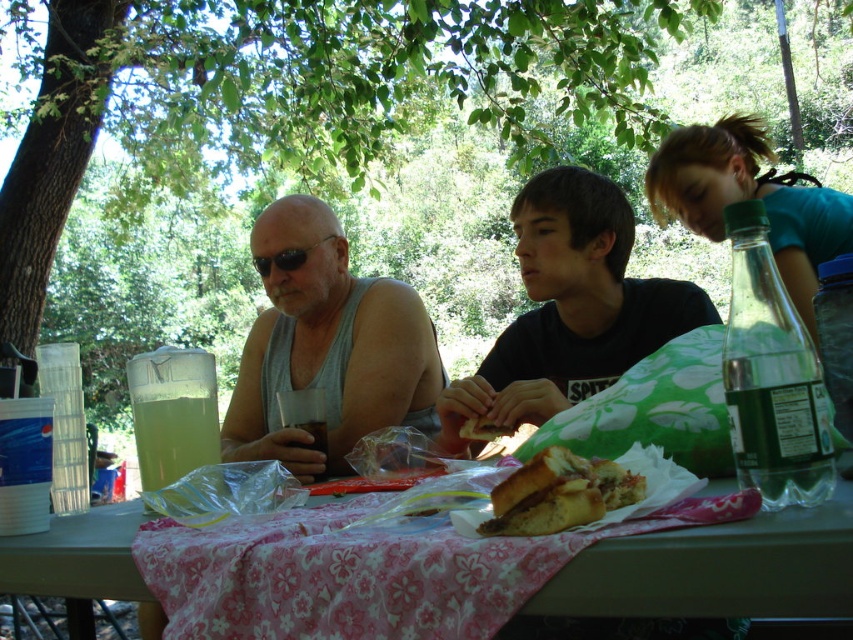
Is brown bread sandwich at center below translucent plastic cup at center?

No.

Does brown bread sandwich at center have a greater width compared to translucent plastic cup at center?

Correct, the width of brown bread sandwich at center exceeds that of translucent plastic cup at center.

Image resolution: width=853 pixels, height=640 pixels. I want to click on brown bread sandwich at center, so click(x=558, y=493).

Does pink floral tablecloth at lower center appear over black matte shirt at center?

No, pink floral tablecloth at lower center is not above black matte shirt at center.

Which of these two, pink floral tablecloth at lower center or black matte shirt at center, stands taller?

Standing taller between the two is black matte shirt at center.

Who is more forward, (346, 636) or (573, 289)?

Point (346, 636)

At what (x,y) coordinates should I click in order to perform the action: click on pink floral tablecloth at lower center. Please return your answer as a coordinate pair (x, y). Looking at the image, I should click on (488, 573).

Is translucent plastic cup at table left shorter than black plastic sunglasses at left?

No.

The image size is (853, 640). What do you see at coordinates (173, 436) in the screenshot?
I see `translucent plastic cup at table left` at bounding box center [173, 436].

You are a GUI agent. You are given a task and a screenshot of the screen. Output one action in this format:
    pyautogui.click(x=<x>, y=<y>)
    Task: Click on the translucent plastic cup at table left
    This screenshot has height=640, width=853.
    Given the screenshot: What is the action you would take?
    pyautogui.click(x=173, y=436)